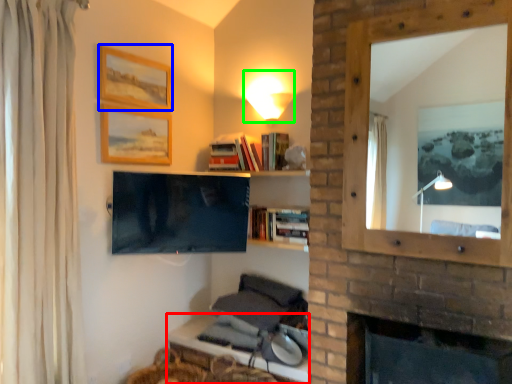
Question: Which object is positioned farthest from table (highlighted by a red box)? Select from picture frame (highlighted by a blue box) and light fixture (highlighted by a green box).

Choices:
 (A) picture frame
 (B) light fixture

Answer: (A)